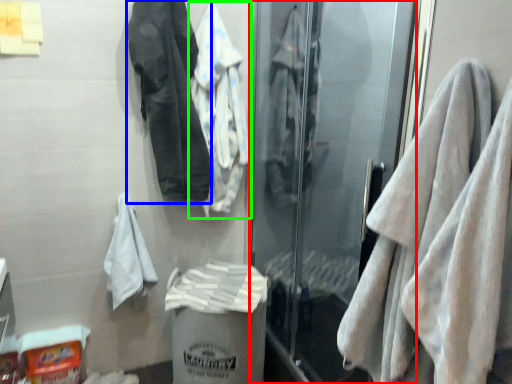
Question: Considering the real-world distances, which object is farthest from screen door (highlighted by a red box)? jacket (highlighted by a blue box) or jacket (highlighted by a green box)?

Choices:
 (A) jacket
 (B) jacket

Answer: (A)